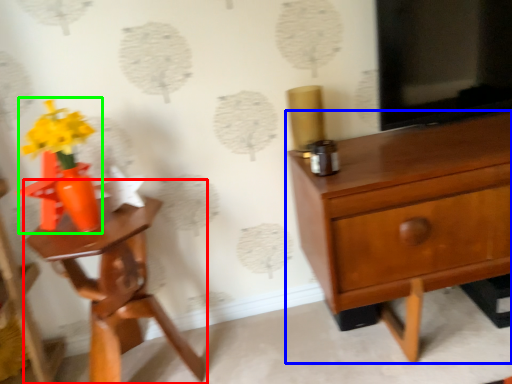
Question: Which object is the farthest from nightstand (highlighted by a red box)? Choose among these: chest of drawers (highlighted by a blue box) or floral arrangement (highlighted by a green box).

Choices:
 (A) chest of drawers
 (B) floral arrangement

Answer: (A)